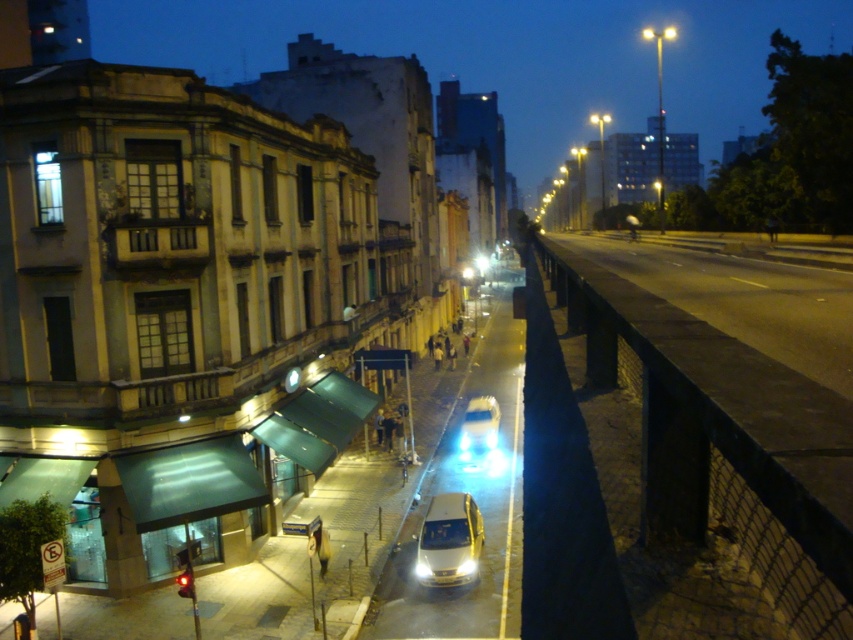
You are a pedestrian standing on the sidewalk and want to cross the street to reach the shiny silver car at center. Is the yellow matte car at center blocking your path?

The yellow matte car at center is closer to the viewer than the shiny silver car at center, so the yellow matte car at center is blocking the path to the shiny silver car at center.

You are a pedestrian standing on the sidewalk and want to cross the street to reach the shiny silver car at center. Is the yellow matte car at center blocking your path?

The yellow matte car at center is below the shiny silver car at center, so it is positioned lower and likely closer to the sidewalk. This means the yellow matte car at center is blocking your path to the shiny silver car at center.